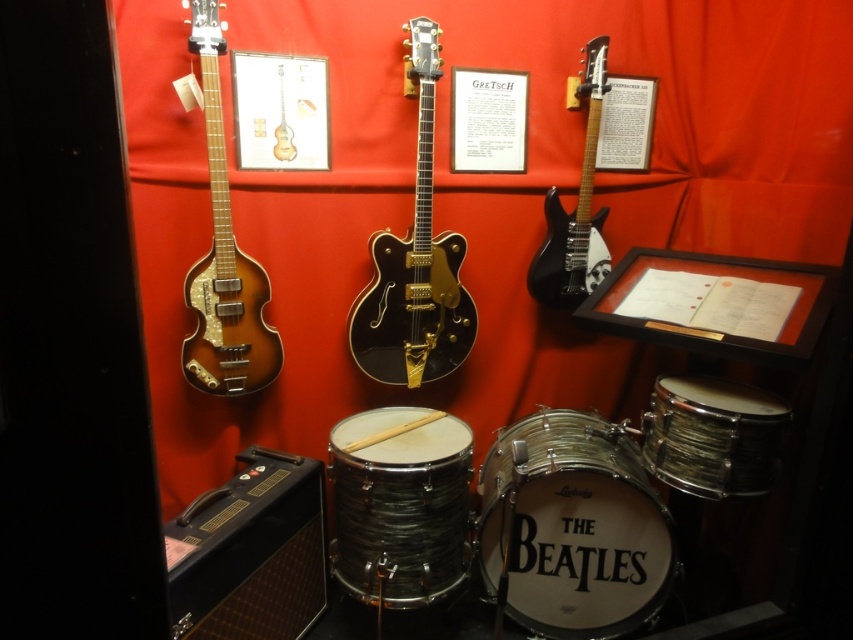
In the scene shown: Can you confirm if satin wood bass guitar at left is bigger than wooden snare drum at lower right?

Correct, satin wood bass guitar at left is larger in size than wooden snare drum at lower right.

Which is in front, point (206, 381) or point (729, 419)?

Point (729, 419) is in front.

Which is behind, point (235, 344) or point (759, 403)?

Positioned behind is point (235, 344).

You are a GUI agent. You are given a task and a screenshot of the screen. Output one action in this format:
    pyautogui.click(x=<x>, y=<y>)
    Task: Click on the satin wood bass guitar at left
    The height and width of the screenshot is (640, 853).
    Given the screenshot: What is the action you would take?
    pyautogui.click(x=224, y=259)

Can you confirm if white leather drum at lower right is positioned to the right of black matte electric guitar at upper right?

No, white leather drum at lower right is not to the right of black matte electric guitar at upper right.

Between white leather drum at lower right and black matte electric guitar at upper right, which one is positioned higher?

Positioned higher is black matte electric guitar at upper right.

Between point (605, 476) and point (540, 269), which one is positioned in front?

Point (605, 476) is more forward.

Locate an element on the screen. Image resolution: width=853 pixels, height=640 pixels. white leather drum at lower right is located at coordinates (572, 528).

Which is more to the right, wooden snare drum at lower right or black matte electric guitar at upper right?

wooden snare drum at lower right is more to the right.

Is point (757, 388) positioned after point (581, 237)?

No, it is in front of (581, 237).

This screenshot has height=640, width=853. Identify the location of wooden snare drum at lower right. 712,435.